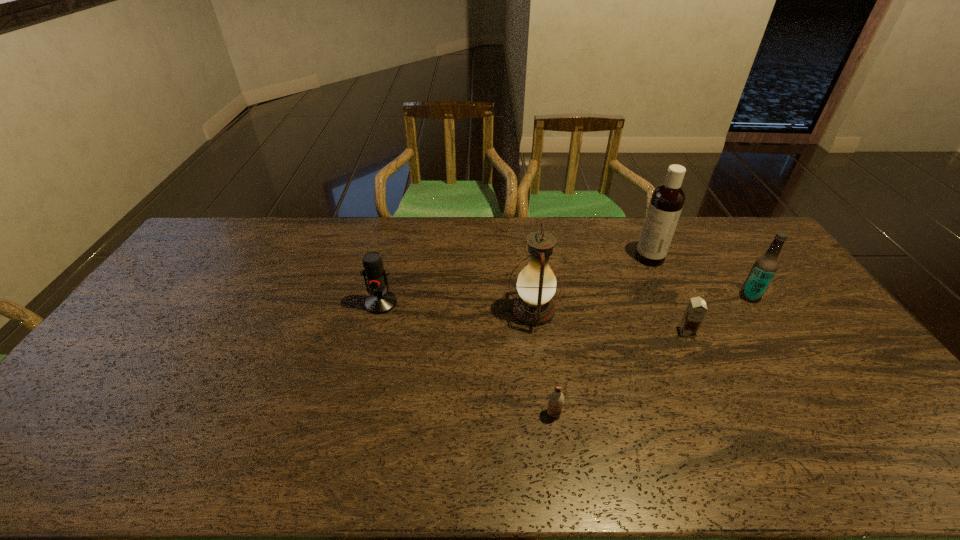
This screenshot has height=540, width=960. What are the coordinates of `free space between the farthest object and the second shortest object` in the screenshot? It's located at (668, 295).

What are the coordinates of `free space that is in between the beer bottle and the taller chocolate milk` in the screenshot? It's located at (718, 314).

Where is `free point between the nearer chocolate milk and the farthest object`? The height and width of the screenshot is (540, 960). free point between the nearer chocolate milk and the farthest object is located at coordinates (602, 336).

Image resolution: width=960 pixels, height=540 pixels. Identify the location of free space between the nearest object and the beer bottle. (652, 355).

Where is `free space between the leftmost object and the left chocolate milk`? The width and height of the screenshot is (960, 540). free space between the leftmost object and the left chocolate milk is located at coordinates (468, 359).

Where is `the fifth closest object to the oil lamp`? The width and height of the screenshot is (960, 540). the fifth closest object to the oil lamp is located at coordinates 765,267.

Where is `object that is the closest to the right chocolate milk`? The image size is (960, 540). object that is the closest to the right chocolate milk is located at coordinates (765, 267).

The width and height of the screenshot is (960, 540). In order to click on free spot that satisfies the following two spatial constraints: 1. on the label side of the second shortest object; 2. on the right side of the dishwasher detergent in this screenshot , I will do `click(684, 332)`.

Identify the location of blank area in the image that satisfies the following two spatial constraints: 1. on the front side of the farther chocolate milk; 2. on the right side of the oil lamp. (536, 332).

Locate an element on the screen. free region that satisfies the following two spatial constraints: 1. on the back side of the taller chocolate milk; 2. on the label side of the dishwasher detergent is located at coordinates (652, 258).